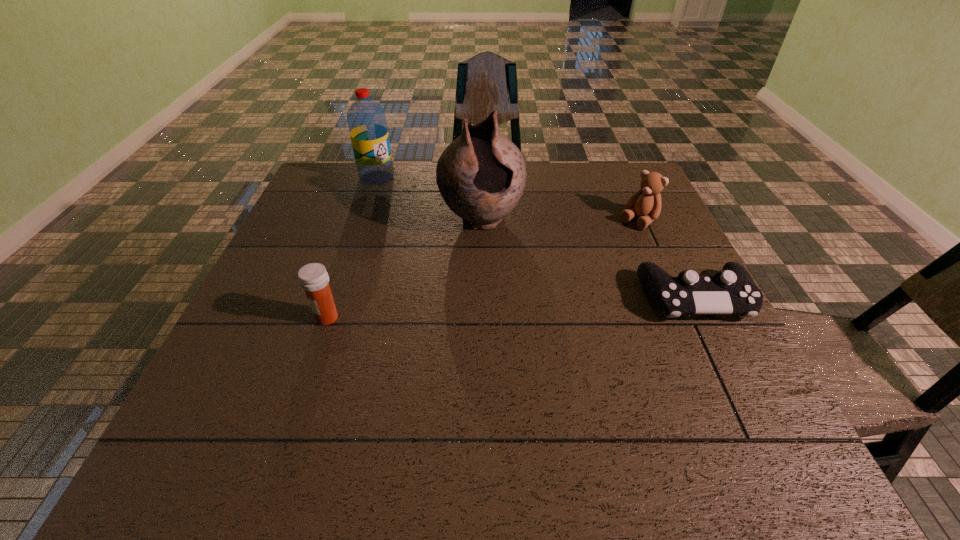
You are a GUI agent. You are given a task and a screenshot of the screen. Output one action in this format:
    pyautogui.click(x=<x>, y=<y>)
    Task: Click on the free space located on the front-facing side of the teddy bear
    Image resolution: width=960 pixels, height=540 pixels.
    Given the screenshot: What is the action you would take?
    pyautogui.click(x=589, y=266)

The image size is (960, 540). Find the location of `vacant region located 0.070m on the front-facing side of the teddy bear`. vacant region located 0.070m on the front-facing side of the teddy bear is located at coordinates (615, 241).

Find the location of a particular element. The width and height of the screenshot is (960, 540). vacant space located on the front-facing side of the teddy bear is located at coordinates (598, 258).

Where is `free spot located 0.370m from the spout of the pottery`? free spot located 0.370m from the spout of the pottery is located at coordinates (535, 357).

You are a GUI agent. You are given a task and a screenshot of the screen. Output one action in this format:
    pyautogui.click(x=<x>, y=<y>)
    Task: Click on the vacant space located from the spout of the pottery
    
    Given the screenshot: What is the action you would take?
    pyautogui.click(x=497, y=260)

The width and height of the screenshot is (960, 540). I want to click on blank space located from the spout of the pottery, so click(x=506, y=284).

At what (x,y) coordinates should I click in order to perform the action: click on free space located 0.090m on the front label of the farthest object. Please return your answer as a coordinate pair (x, y). This screenshot has height=540, width=960. Looking at the image, I should click on pos(396,199).

Identify the location of vacant space located 0.390m on the front label of the farthest object. tap(447, 253).

Image resolution: width=960 pixels, height=540 pixels. I want to click on free region located 0.290m on the front label of the farthest object, so click(428, 233).

Locate an element on the screen. The width and height of the screenshot is (960, 540). pottery located in the far edge section of the desktop is located at coordinates (481, 175).